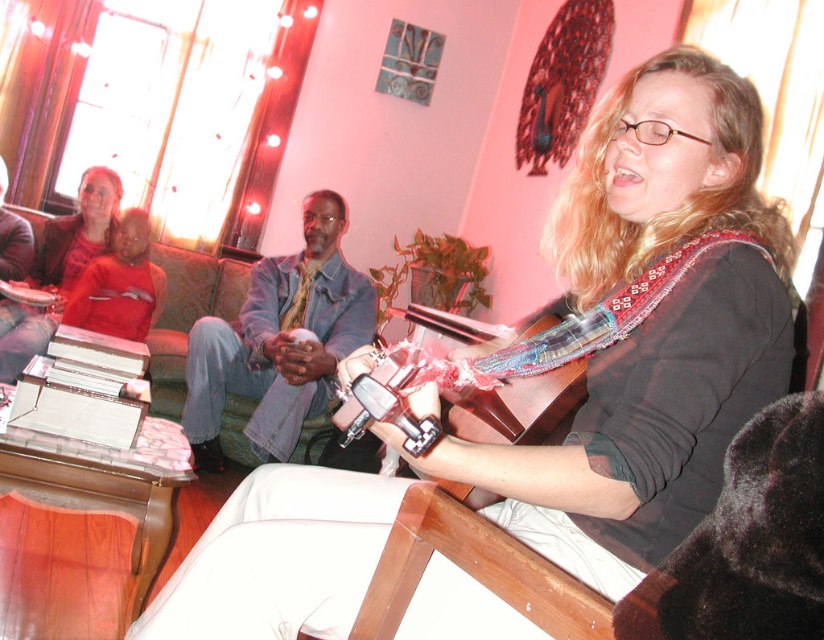
Question: Which of the following is the closest to the observer?

Choices:
 (A) (366, 296)
 (B) (137, 275)
 (C) (325, 460)

Answer: (C)

Question: Which object is positioned closest to the metallic silver guitar at center?

Choices:
 (A) denim jacket at center
 (B) matte red shirt at upper left

Answer: (A)

Question: Observing the image, what is the correct spatial positioning of denim jacket at center in reference to matte red shirt at upper left?

Choices:
 (A) left
 (B) right

Answer: (B)

Question: Does matte red shirt at upper left appear over metallic silver guitar at center?

Choices:
 (A) yes
 (B) no

Answer: (A)

Question: Which is farther from the matte red shirt at upper left?

Choices:
 (A) denim jacket at center
 (B) metallic silver guitar at center

Answer: (B)

Question: Considering the relative positions of denim jacket at center and matte red shirt at upper left in the image provided, where is denim jacket at center located with respect to matte red shirt at upper left?

Choices:
 (A) left
 (B) right

Answer: (B)